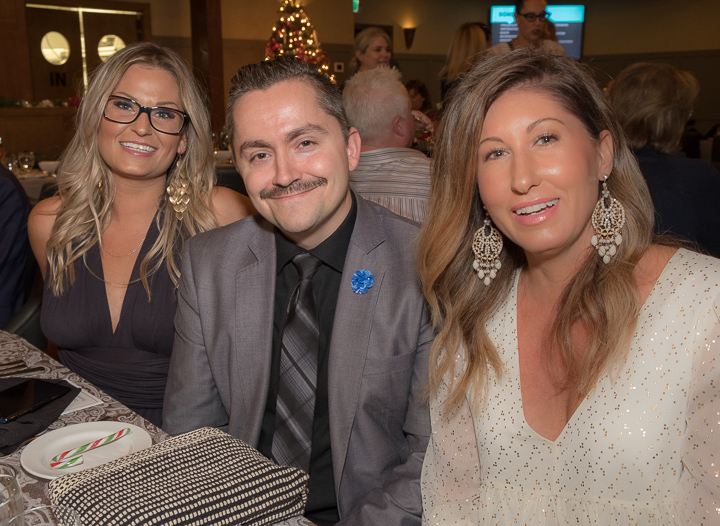
You are a GUI agent. You are given a task and a screenshot of the screen. Output one action in this format:
    pyautogui.click(x=<x>, y=<y>)
    Task: Click on the swinging doors
    The image size is (720, 526).
    Given the screenshot: What is the action you would take?
    pyautogui.click(x=47, y=87), pyautogui.click(x=94, y=53)